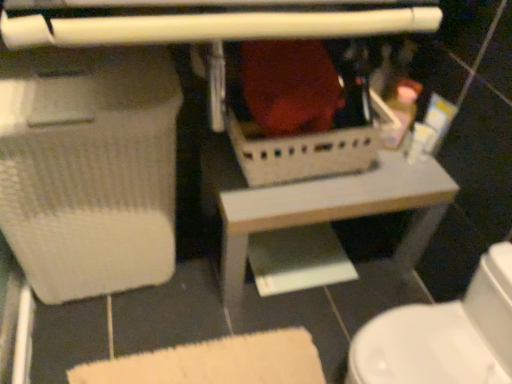
I want to click on free space in front of white plastic basket at center, so click(269, 332).